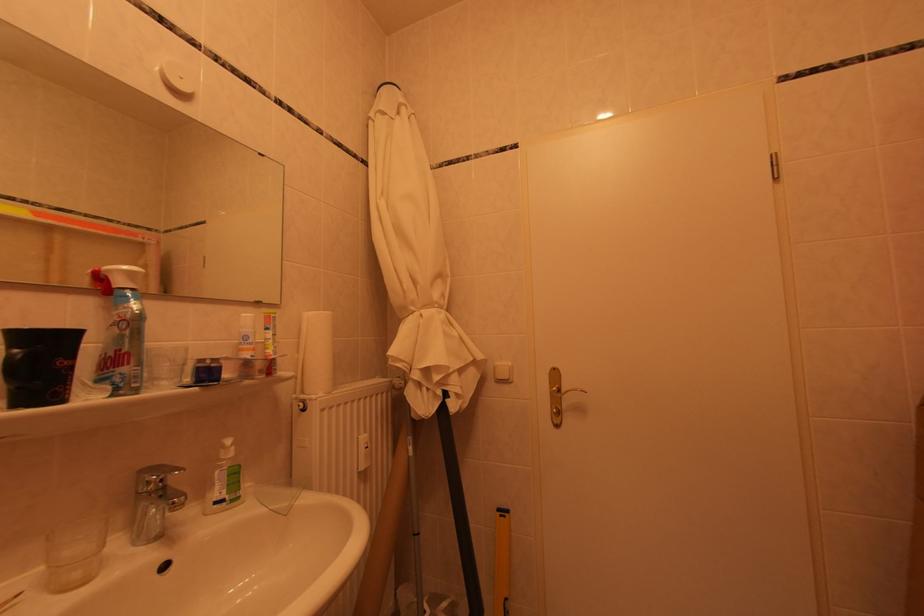
You are a GUI agent. You are given a task and a screenshot of the screen. Output one action in this format:
    pyautogui.click(x=<x>, y=<y>)
    Task: Click on the clear glass cup
    
    Given the screenshot: What is the action you would take?
    pyautogui.click(x=74, y=553)